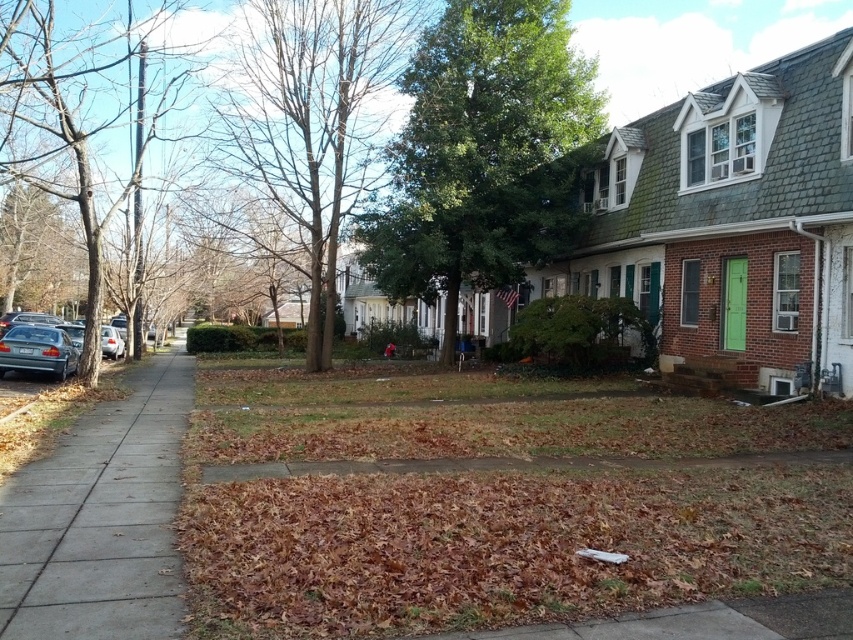
You are a delivery robot with a 1.2 meter wide package. You need to move from the gray concrete sidewalk at lower left to the green leafy tree at center. Can you move directly towards the tree without moving the package?

The distance between the gray concrete sidewalk at lower left and the green leafy tree at center is 10.42 meters. Since the package is 1.2 meters wide, the robot can move directly towards the tree without needing to adjust the package as the distance is sufficient.

You are standing on the sidewalk and want to cross the street to reach the row of houses on the right. There is a metallic blue sedan at left represented by point (38,349). Is the sedan positioned in a way that would block your path to the row of houses on the right?

The metallic blue sedan at left represented by point (38,349) is located at the lower left corner of the image, so it would not block your path to the row of houses on the right which are on the opposite side.

You are standing at the center of the sidewalk and want to walk to the metallic blue sedan at left. Which direction should you turn to face the sedan?

The metallic blue sedan at left is located at point [38,349] in 2D space. Since you are on the sidewalk, which is to the left of the street, the sedan is likely positioned to your left side. Therefore, you should turn left to face the metallic blue sedan at left.